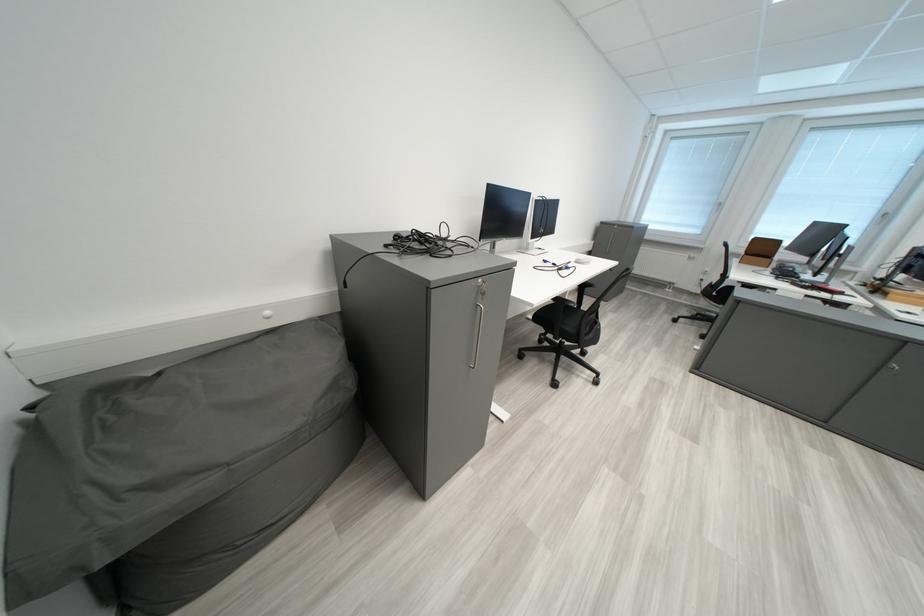
At what (x,y) coordinates should I click in order to perform the action: click on silver cabinet handle. Please return your answer as a coordinate pair (x, y). The image size is (924, 616). Looking at the image, I should click on (477, 334).